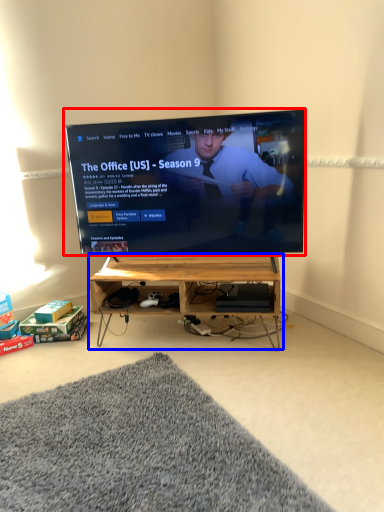
Question: Which of the following is the farthest to the observer, television (highlighted by a red box) or shelf (highlighted by a blue box)?

Choices:
 (A) television
 (B) shelf

Answer: (B)